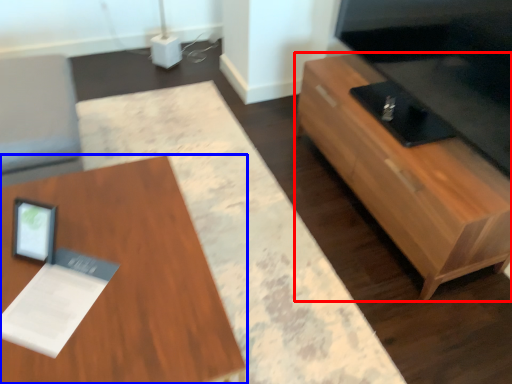
Question: Among these objects, which one is farthest to the camera, table (highlighted by a red box) or table (highlighted by a blue box)?

Choices:
 (A) table
 (B) table

Answer: (A)